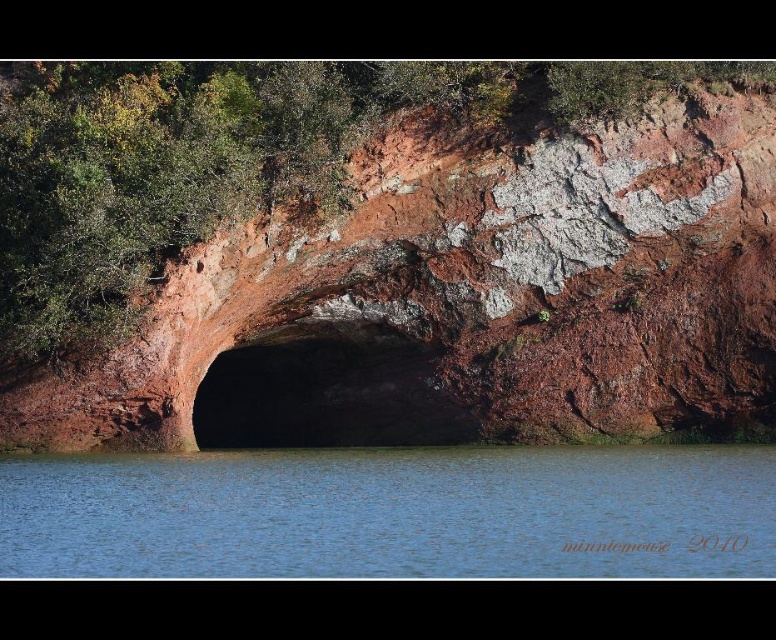
You are standing on the edge of the blue water at center and want to climb up to the brown rough cave at center. Is the cave above or below your current position?

The brown rough cave at center is above the blue water at center, so the cave is above your current position.

You are a hiker who wants to take a photo of the rusty rock cave at center and the blue water at center. Which one should you focus on first if you want to capture both in one frame?

The rusty rock cave at center is above the blue water at center, so you should focus on the rusty rock cave at center first to ensure both are in focus.

You are standing at the edge of the scene and want to walk towards the blue water at center. Which direction should you move relative to the rusty rock cave at center?

The rusty rock cave at center is to the left of blue water at center, so you should move to the right of the rusty rock cave at center to reach the blue water at center.